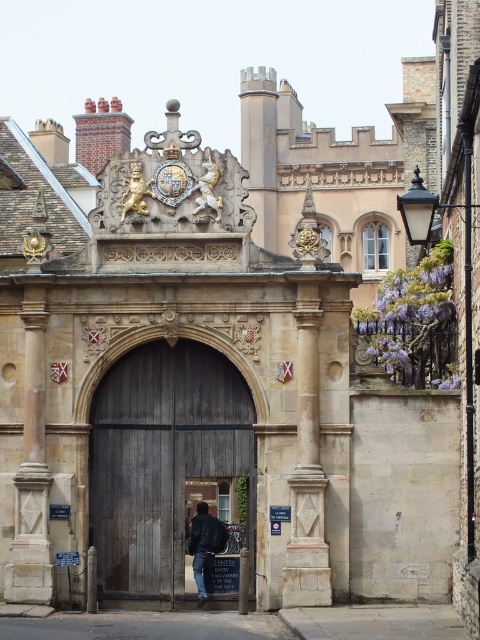
Question: Observing the image, what is the correct spatial positioning of wooden gate at center in reference to dark blue jacket at center?

Choices:
 (A) above
 (B) below

Answer: (A)

Question: Which of these objects is positioned closest to the dark blue jacket at center?

Choices:
 (A) wooden gate at center
 (B) purple wisteria at upper right

Answer: (A)

Question: Is wooden gate at center thinner than purple wisteria at upper right?

Choices:
 (A) no
 (B) yes

Answer: (A)

Question: From the image, what is the correct spatial relationship of purple wisteria at upper right in relation to dark blue jacket at center?

Choices:
 (A) right
 (B) left

Answer: (A)

Question: Which point is closer to the camera?

Choices:
 (A) dark blue jacket at center
 (B) purple wisteria at upper right
 (C) wooden gate at center

Answer: (B)

Question: Which object is farther from the camera taking this photo?

Choices:
 (A) dark blue jacket at center
 (B) purple wisteria at upper right

Answer: (A)